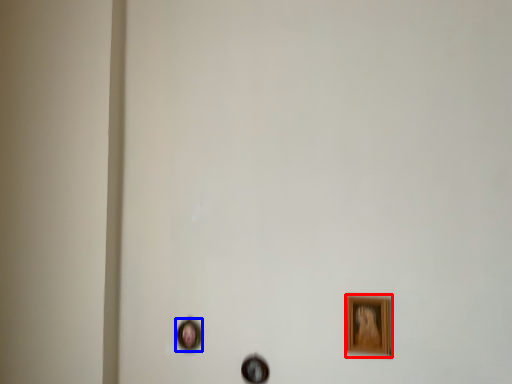
Question: Which object is closer to the camera taking this photo, picture frame (highlighted by a red box) or picture frame (highlighted by a blue box)?

Choices:
 (A) picture frame
 (B) picture frame

Answer: (A)